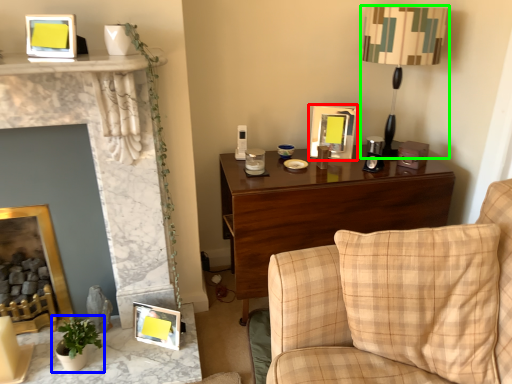
Question: Considering the real-world distances, which object is closest to picture frame (highlighted by a red box)? houseplant (highlighted by a blue box) or table lamp (highlighted by a green box).

Choices:
 (A) houseplant
 (B) table lamp

Answer: (B)